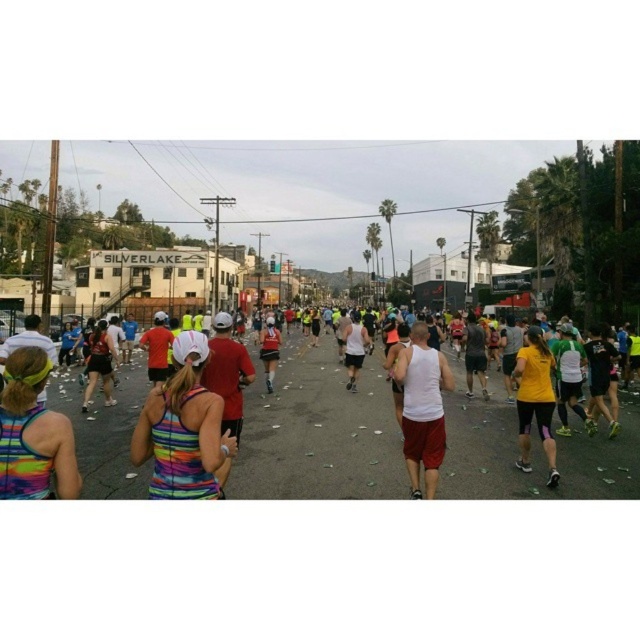
Question: Is multicolored tank top at center positioned in front of yellow fabric at right?

Choices:
 (A) no
 (B) yes

Answer: (B)

Question: Which object is closer to the camera taking this photo?

Choices:
 (A) yellow fabric at right
 (B) multicolored tank top at center
 (C) white matte tank top at center
 (D) multicolored fabric tank top at center

Answer: (D)

Question: Which object is closer to the camera taking this photo?

Choices:
 (A) white matte tank top at center
 (B) multicolored tank top at center
 (C) yellow fabric at right

Answer: (A)

Question: Does multicolored tank top at center appear on the right side of multicolored fabric tank top at center?

Choices:
 (A) no
 (B) yes

Answer: (B)

Question: Which point appears closest to the camera in this image?

Choices:
 (A) (218, 474)
 (B) (332, 380)
 (C) (525, 448)

Answer: (A)

Question: Does multicolored fabric tank top at center have a larger size compared to yellow fabric at right?

Choices:
 (A) yes
 (B) no

Answer: (A)